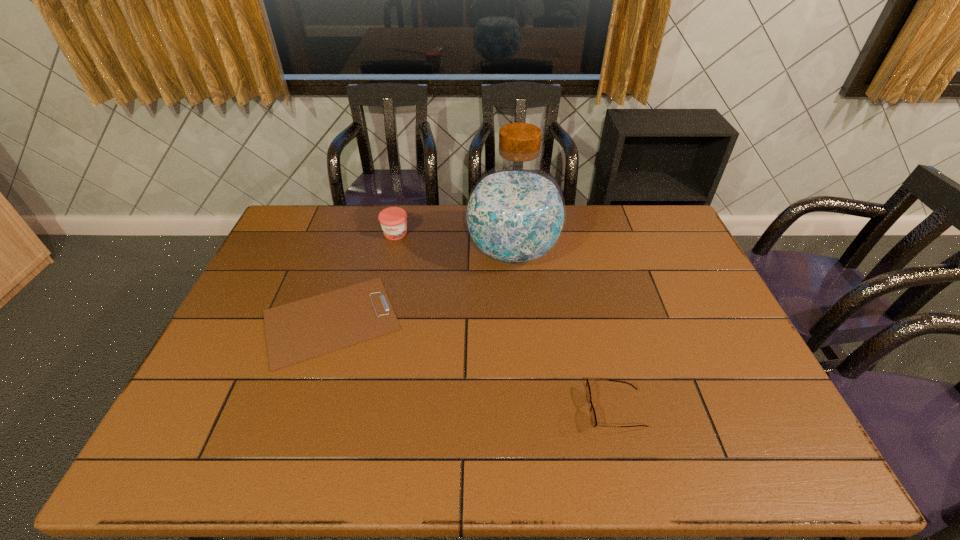
Where is `vacant space that's between the spectacles and the jam`? The width and height of the screenshot is (960, 540). vacant space that's between the spectacles and the jam is located at coordinates (505, 322).

This screenshot has height=540, width=960. Find the location of `vacant region between the clipboard and the spectacles`. vacant region between the clipboard and the spectacles is located at coordinates (473, 365).

Identify the location of vacant space that's between the third tallest object and the water jug. (564, 331).

This screenshot has width=960, height=540. I want to click on unoccupied position between the jam and the spectacles, so click(505, 322).

Find the location of a particular element. The width and height of the screenshot is (960, 540). blank region between the tallest object and the clipboard is located at coordinates (422, 286).

Image resolution: width=960 pixels, height=540 pixels. Identify the location of blank region between the jam and the clipboard. (363, 277).

The image size is (960, 540). I want to click on blank region between the spectacles and the second tallest object, so click(x=505, y=322).

Identify the location of free space that is in between the second shortest object and the jam. (505, 322).

At what (x,y) coordinates should I click in order to perform the action: click on free space between the tallest object and the jam. Please return your answer as a coordinate pair (x, y). Looking at the image, I should click on (454, 242).

You are a GUI agent. You are given a task and a screenshot of the screen. Output one action in this format:
    pyautogui.click(x=<x>, y=<y>)
    Task: Click on the empty space between the third tallest object and the clipboard
    
    Given the screenshot: What is the action you would take?
    pyautogui.click(x=473, y=365)